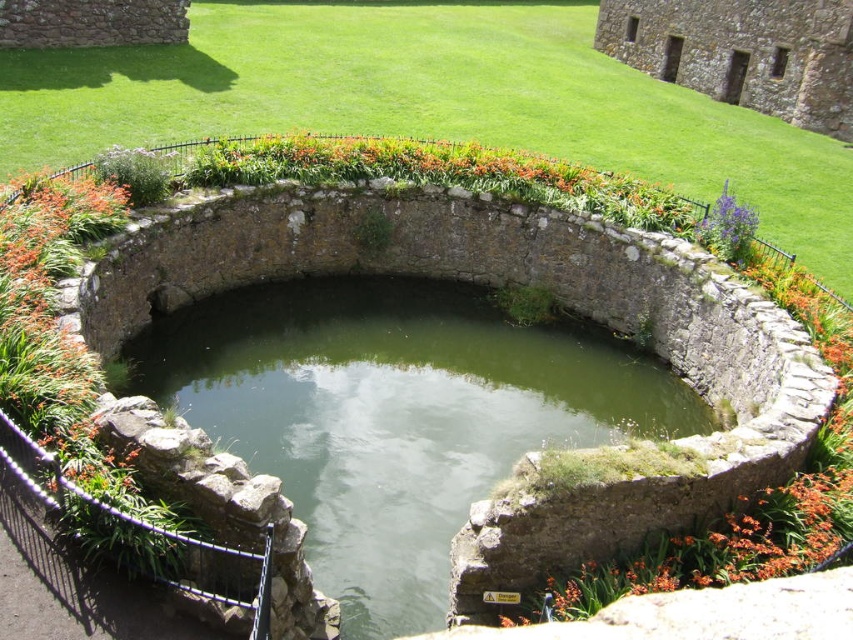
You are standing near the pond and want to place a small statue that is 1 meter tall. The statue needs to be placed where it won the green stone water at center and purple matte flower at upper right. Which object should you place it next to so the statue won be obscured?

The green stone water at center is taller than the purple matte flower at upper right. To ensure the statue isn t obscured, place it next to the purple matte flower at upper right since it is shorter.

You are standing near the pond and want to place a small statue between the green stone water at center and the purple matte flower at upper right. Based on their positions, which object should the statue be closer to?

The statue should be placed closer to the purple matte flower at upper right since the green stone water at center is to the left of it.